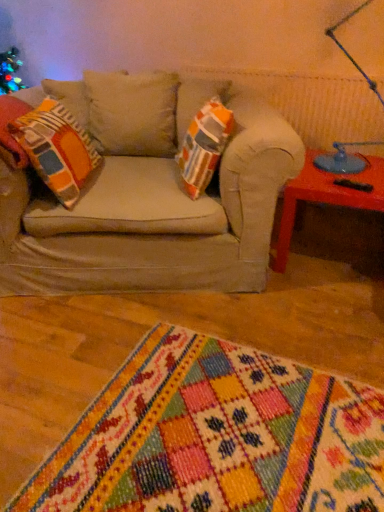
Question: Is point (331, 38) positioned closer to the camera than point (62, 137)?

Choices:
 (A) farther
 (B) closer

Answer: (A)

Question: In terms of width, does blue glass table lamp at upper right look wider or thinner when compared to orange and gray striped pillow at left?

Choices:
 (A) thin
 (B) wide

Answer: (A)

Question: Which object is positioned closest to the orange and gray striped pillow at left?

Choices:
 (A) multicolored woven rug at lower center
 (B) blue glass table lamp at upper right
 (C) matte orange table at right

Answer: (A)

Question: Which object is positioned farthest from the blue glass table lamp at upper right?

Choices:
 (A) matte orange table at right
 (B) multicolored woven rug at lower center
 (C) orange and gray striped pillow at left

Answer: (B)